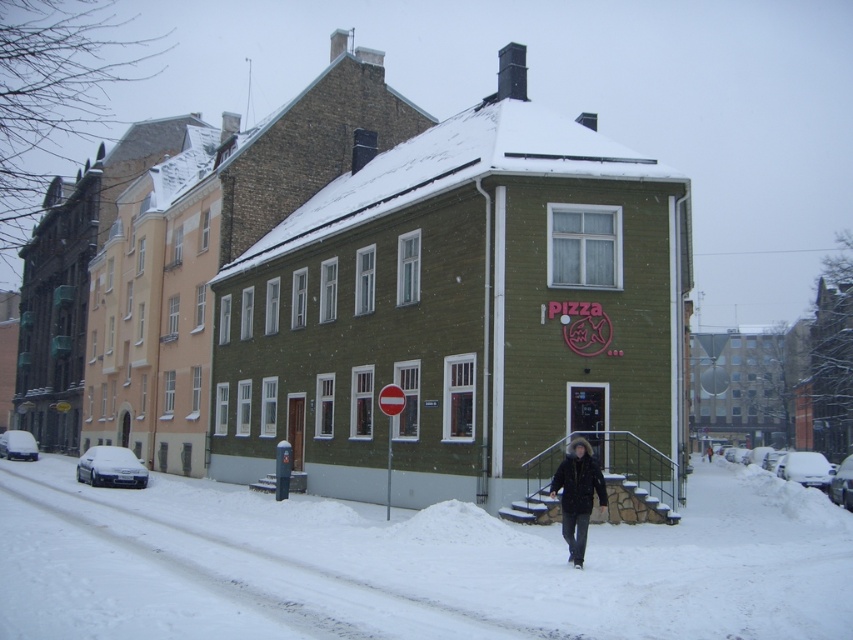
Question: Is dark brown fur-lined coat at lower center to the right of white matte car at lower left from the viewer's perspective?

Choices:
 (A) yes
 (B) no

Answer: (A)

Question: Which of the following is the farthest from the observer?

Choices:
 (A) (796, 472)
 (B) (32, 445)

Answer: (B)

Question: Which object is the closest to the dark brown fur-lined coat at lower center?

Choices:
 (A) white matte car at lower right
 (B) white matte car at left

Answer: (A)

Question: Is dark brown fur-lined coat at lower center wider than black glossy car at lower right?

Choices:
 (A) no
 (B) yes

Answer: (A)

Question: Among these objects, which one is farthest from the camera?

Choices:
 (A) black glossy car at lower right
 (B) white matte car at lower left
 (C) white matte car at lower right

Answer: (B)

Question: Is white matte car at lower left wider than white matte car at left?

Choices:
 (A) no
 (B) yes

Answer: (A)